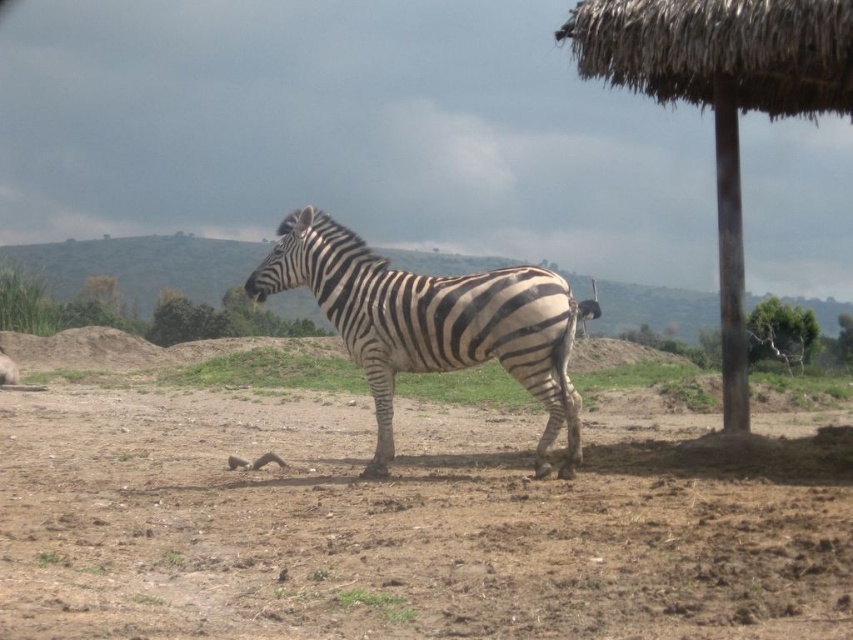
Question: Based on their relative distances, which object is nearer to the brown wooden pole at right?

Choices:
 (A) thatched straw umbrella at upper right
 (B) green leafy tree at upper right
 (C) brown soil at center
 (D) black and white striped zebra at center

Answer: (A)

Question: Which point is closer to the camera?

Choices:
 (A) green leafy tree at upper right
 (B) brown wooden pole at right

Answer: (A)

Question: Which of the following is the farthest from the observer?

Choices:
 (A) (799, 371)
 (B) (772, 17)
 (C) (737, 284)

Answer: (A)

Question: Can you confirm if brown soil at center is smaller than thatched straw umbrella at upper right?

Choices:
 (A) yes
 (B) no

Answer: (A)

Question: Can you confirm if brown wooden pole at right is positioned above green leafy tree at upper right?

Choices:
 (A) yes
 (B) no

Answer: (A)

Question: Is thatched straw umbrella at upper right to the left of green leafy tree at upper right from the viewer's perspective?

Choices:
 (A) yes
 (B) no

Answer: (A)